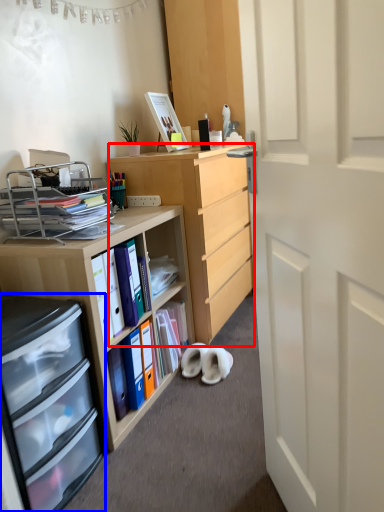
Question: Among these objects, which one is nearest to the camera, desk (highlighted by a red box) or cabinetry (highlighted by a blue box)?

Choices:
 (A) desk
 (B) cabinetry

Answer: (B)